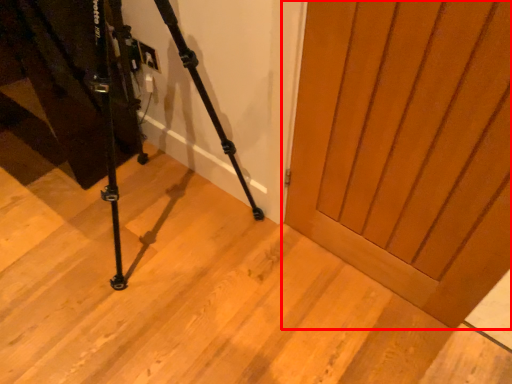
Question: From the image, what is the correct spatial relationship of door (annotated by the red box) in relation to tripod?

Choices:
 (A) left
 (B) right

Answer: (B)